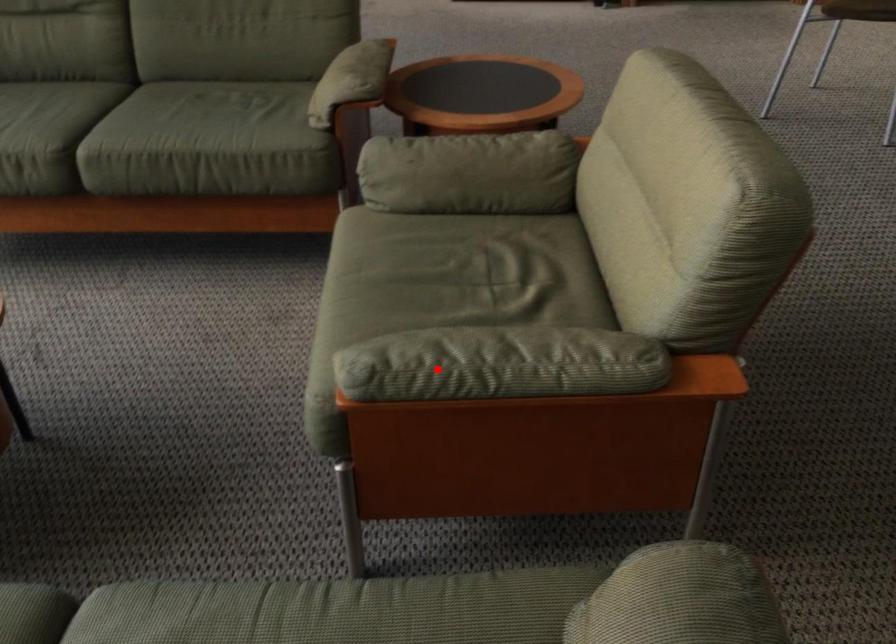
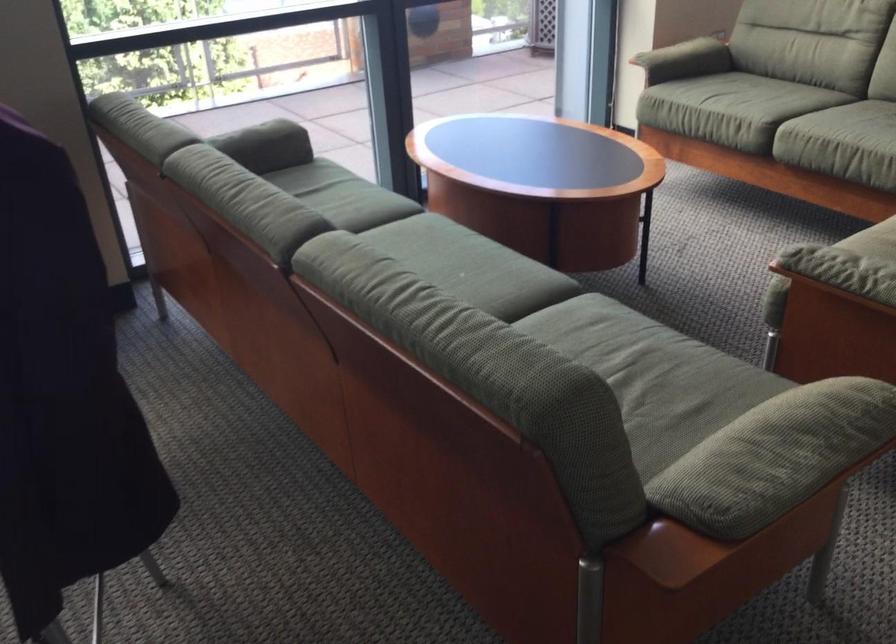
Question: A red point is marked in image1. In image2, is the corresponding 3D point closer to the camera or farther? Reply with the corresponding letter.

Choices:
 (A) The corresponding 3D point is closer.
 (B) The corresponding 3D point is farther.

Answer: (B)